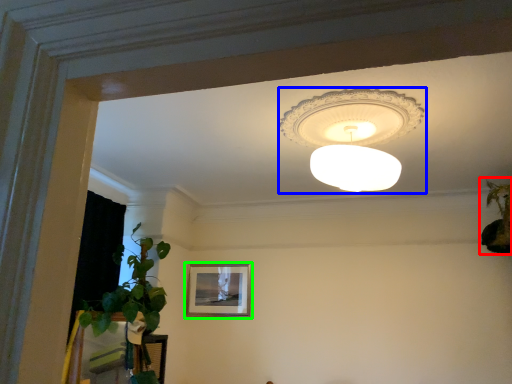
Question: Estimate the real-world distances between objects in this image. Which object is closer to houseplant (highlighted by a red box), lamp (highlighted by a blue box) or picture frame (highlighted by a green box)?

Choices:
 (A) lamp
 (B) picture frame

Answer: (A)